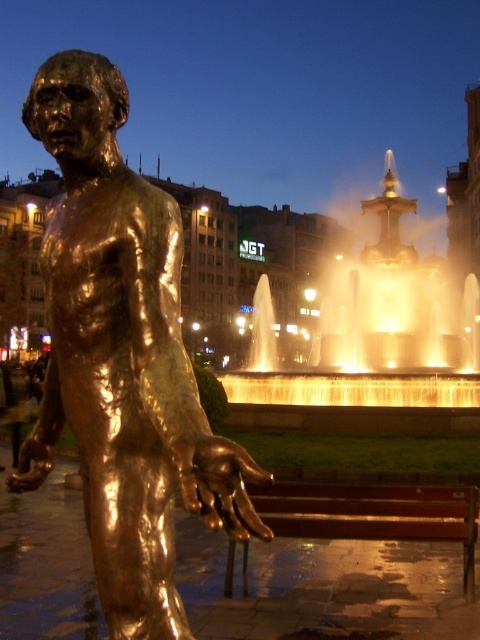
Which of these two, bronze statue at left or golden reflective water at center, stands taller?

golden reflective water at center

Can you confirm if bronze statue at left is positioned to the right of golden reflective water at center?

In fact, bronze statue at left is to the left of golden reflective water at center.

Where is `bronze statue at left`? The height and width of the screenshot is (640, 480). bronze statue at left is located at coordinates (122, 356).

Locate an element on the screen. The height and width of the screenshot is (640, 480). bronze statue at left is located at coordinates (122, 356).

Is bronze statue at left thinner than bronze polished bench at lower center?

No, bronze statue at left is not thinner than bronze polished bench at lower center.

Can you confirm if bronze statue at left is taller than bronze polished bench at lower center?

Yes, bronze statue at left is taller than bronze polished bench at lower center.

Which is behind, point (79, 186) or point (465, 577)?

The point (465, 577) is behind.

At what (x,y) coordinates should I click in order to perform the action: click on bronze statue at left. Please return your answer as a coordinate pair (x, y). Looking at the image, I should click on (122, 356).

Who is higher up, golden reflective water at center or bronze polished bench at lower center?

Positioned higher is golden reflective water at center.

Who is positioned more to the left, golden reflective water at center or bronze polished bench at lower center?

bronze polished bench at lower center is more to the left.

Is point (431, 422) positioned behind point (292, 483)?

Yes, it is.

Where is `golden reflective water at center`? This screenshot has width=480, height=640. golden reflective water at center is located at coordinates (373, 349).